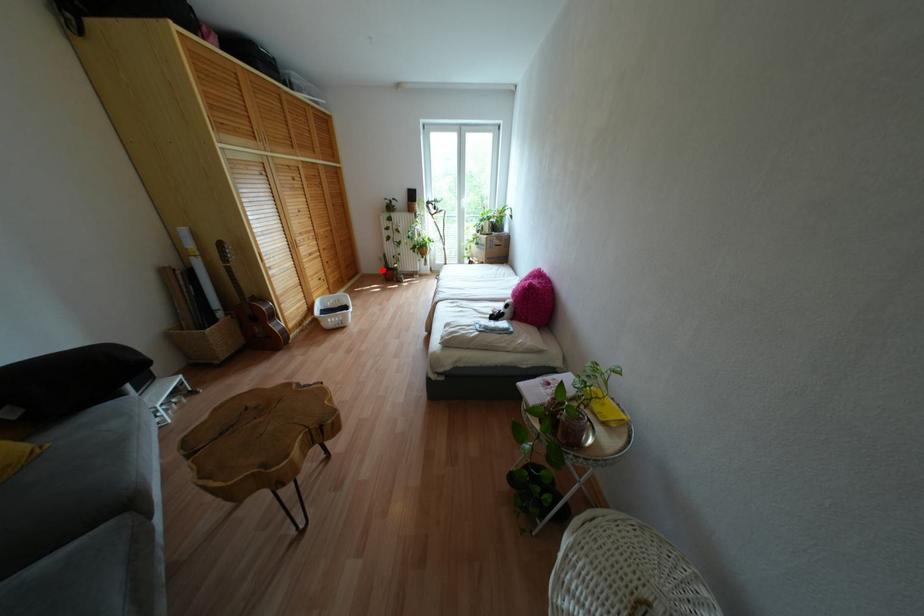
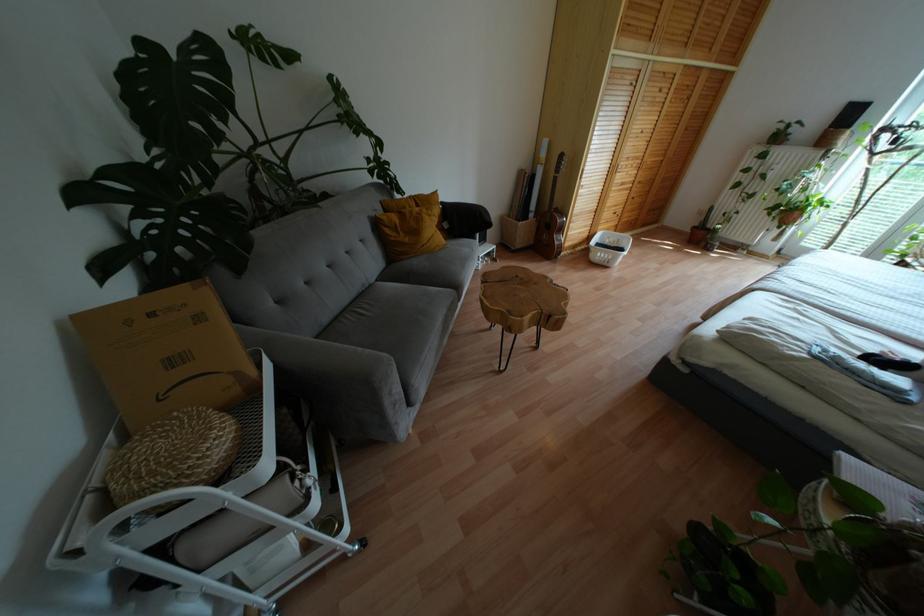
In the second image, find the point that corresponds to the highlighted location in the first image.

(694, 227)